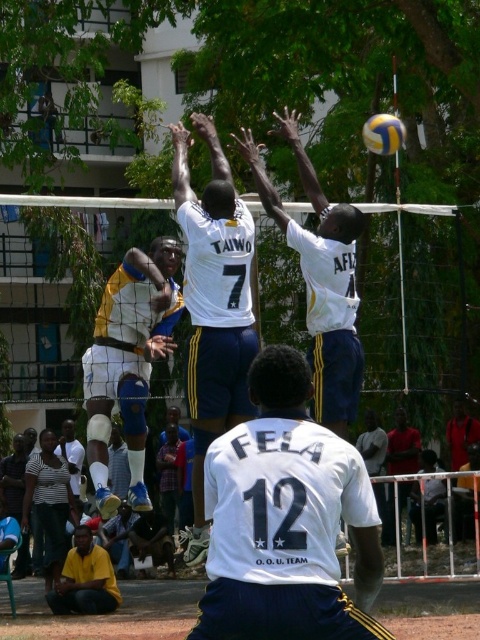
Which is more to the right, white matte jersey at center or yellow and blue uniform at center?

white matte jersey at center is more to the right.

Is white matte jersey at center positioned behind yellow and blue uniform at center?

That is False.

Locate an element on the screen. white matte jersey at center is located at coordinates (214, 304).

Is the position of white matte jersey at center more distant than that of yellow shirt at lower left?

No, white matte jersey at center is closer to the viewer.

From the picture: Is white matte jersey at center below yellow shirt at lower left?

No, white matte jersey at center is not below yellow shirt at lower left.

This screenshot has width=480, height=640. What do you see at coordinates (214, 304) in the screenshot?
I see `white matte jersey at center` at bounding box center [214, 304].

Identify the location of white matte jersey at center. (214, 304).

Is white jersey at center further to the viewer compared to yellow shirt at lower left?

No, it is in front of yellow shirt at lower left.

Does white jersey at center appear on the left side of yellow shirt at lower left?

Incorrect, white jersey at center is not on the left side of yellow shirt at lower left.

You are a GUI agent. You are given a task and a screenshot of the screen. Output one action in this format:
    pyautogui.click(x=<x>, y=<y>)
    Task: Click on the white jersey at center
    The width and height of the screenshot is (480, 640).
    Given the screenshot: What is the action you would take?
    pyautogui.click(x=287, y=520)

Identify the location of white jersey at center. click(287, 520).